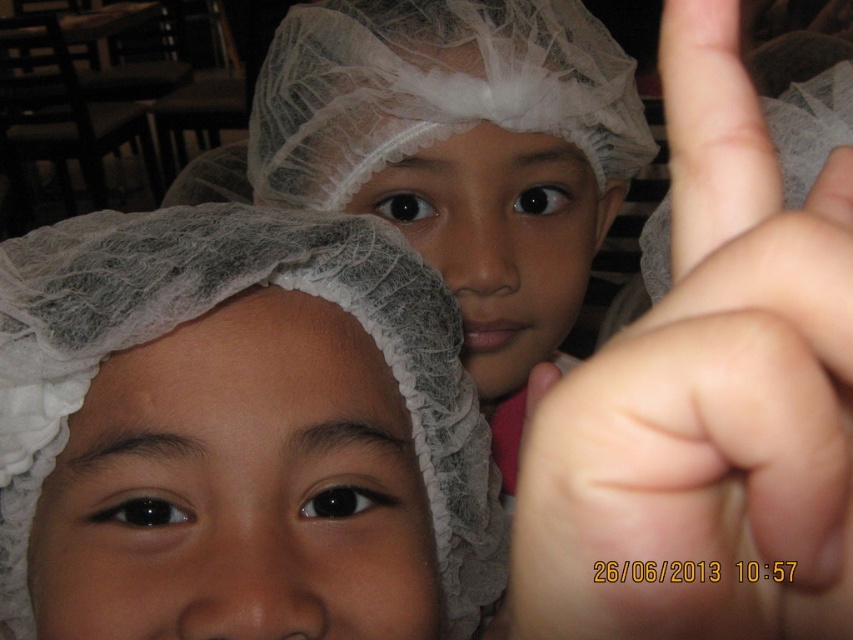
Does white matte finger at upper right appear on the left side of skin/smooth/finger at upper right?

Indeed, white matte finger at upper right is positioned on the left side of skin/smooth/finger at upper right.

I want to click on white matte finger at upper right, so click(704, 396).

Between white matte finger at upper right and white mesh cap at upper left, which one appears on the left side from the viewer's perspective?

white mesh cap at upper left

Is white matte finger at upper right bigger than white mesh cap at upper left?

Incorrect, white matte finger at upper right is not larger than white mesh cap at upper left.

Does point (825, 406) lie behind point (364, 252)?

No, (825, 406) is closer to viewer.

Identify the location of white matte finger at upper right. This screenshot has width=853, height=640. (704, 396).

Between point (39, 332) and point (743, 216), which one is positioned behind?

Positioned behind is point (39, 332).

Is white mesh cap at upper left above skin/smooth/finger at upper right?

No.

Describe the element at coordinates (201, 314) in the screenshot. I see `white mesh cap at upper left` at that location.

Where is `white mesh cap at upper left`? The height and width of the screenshot is (640, 853). white mesh cap at upper left is located at coordinates (201, 314).